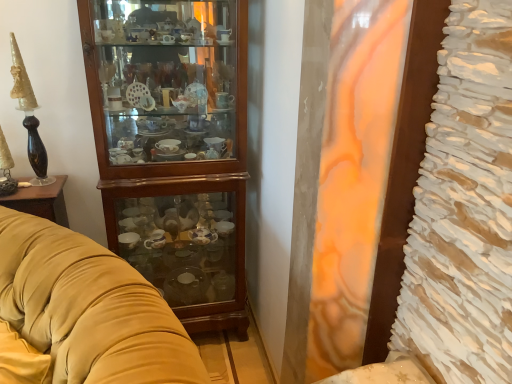
Locate an element on the screen. The width and height of the screenshot is (512, 384). wooden cabinet at left is located at coordinates (174, 145).

This screenshot has width=512, height=384. What do you see at coordinates (174, 145) in the screenshot? I see `wooden cabinet at left` at bounding box center [174, 145].

This screenshot has width=512, height=384. In order to click on velvet yellow couch at left in this screenshot , I will do `click(88, 308)`.

What is the approximate height of velvet yellow couch at left?

35.63 inches.

What do you see at coordinates (88, 308) in the screenshot? Image resolution: width=512 pixels, height=384 pixels. I see `velvet yellow couch at left` at bounding box center [88, 308].

Identify the location of wooden cabinet at left. (174, 145).

In the image, is velvet yellow couch at left on the left side or the right side of wooden cabinet at left?

velvet yellow couch at left is positioned on wooden cabinet at left's left side.

Which object is closer to the camera, velvet yellow couch at left or wooden cabinet at left?

velvet yellow couch at left is closer to the camera.

Which is closer, (20,212) or (226,155)?

Positioned in front is point (20,212).

From the image's perspective, between velvet yellow couch at left and wooden cabinet at left, which one is located above?

From the image's view, wooden cabinet at left is above.

From a real-world perspective, relative to wooden cabinet at left, is velvet yellow couch at left vertically above or below?

Clearly, from a real-world perspective, velvet yellow couch at left is below wooden cabinet at left.

Considering the relative sizes of velvet yellow couch at left and wooden cabinet at left in the image provided, is velvet yellow couch at left thinner than wooden cabinet at left?

Incorrect, the width of velvet yellow couch at left is not less than that of wooden cabinet at left.

Who is taller, velvet yellow couch at left or wooden cabinet at left?

Standing taller between the two is wooden cabinet at left.

Considering the sizes of objects velvet yellow couch at left and wooden cabinet at left in the image provided, who is smaller, velvet yellow couch at left or wooden cabinet at left?

wooden cabinet at left is smaller.

Would you say velvet yellow couch at left is inside or outside wooden cabinet at left?

velvet yellow couch at left is not enclosed by wooden cabinet at left.

Is velvet yellow couch at left touching wooden cabinet at left?

No, velvet yellow couch at left is not next to wooden cabinet at left.

Is velvet yellow couch at left looking in the opposite direction of wooden cabinet at left?

That's right, velvet yellow couch at left is facing away from wooden cabinet at left.

What's the angular difference between velvet yellow couch at left and wooden cabinet at left's facing directions?

They differ by 4.62 degrees in their facing directions.

At what (x,y) coordinates should I click in order to perform the action: click on cabinetry behind the velvet yellow couch at left. Please return your answer as a coordinate pair (x, y). This screenshot has height=384, width=512. Looking at the image, I should click on (174, 145).

Which object is positioned more to the right, wooden cabinet at left or velvet yellow couch at left?

From the viewer's perspective, wooden cabinet at left appears more on the right side.

Does wooden cabinet at left lie in front of velvet yellow couch at left?

No, it is behind velvet yellow couch at left.

Considering the points (242, 127) and (127, 349), which point is in front, point (242, 127) or point (127, 349)?

The point (127, 349) is more forward.

From the image's perspective, which is below, wooden cabinet at left or velvet yellow couch at left?

velvet yellow couch at left.

From a real-world perspective, is wooden cabinet at left physically located above or below velvet yellow couch at left?

wooden cabinet at left is situated higher than velvet yellow couch at left in the real world.

Based on the photo, which object is wider, wooden cabinet at left or velvet yellow couch at left?

velvet yellow couch at left is wider.

Is wooden cabinet at left shorter than velvet yellow couch at left?

No, wooden cabinet at left is not shorter than velvet yellow couch at left.

Who is bigger, wooden cabinet at left or velvet yellow couch at left?

velvet yellow couch at left.

Would you say wooden cabinet at left is outside velvet yellow couch at left?

Absolutely, wooden cabinet at left is external to velvet yellow couch at left.

Would you consider wooden cabinet at left to be distant from velvet yellow couch at left?

They are positioned close to each other.

Based on the photo, is wooden cabinet at left oriented towards velvet yellow couch at left?

Yes, wooden cabinet at left is oriented towards velvet yellow couch at left.

I want to click on studio couch in front of the wooden cabinet at left, so click(88, 308).

Where is `cabinetry to the right of velvet yellow couch at left`? This screenshot has width=512, height=384. cabinetry to the right of velvet yellow couch at left is located at coordinates (174, 145).

Image resolution: width=512 pixels, height=384 pixels. I want to click on cabinetry behind the velvet yellow couch at left, so click(174, 145).